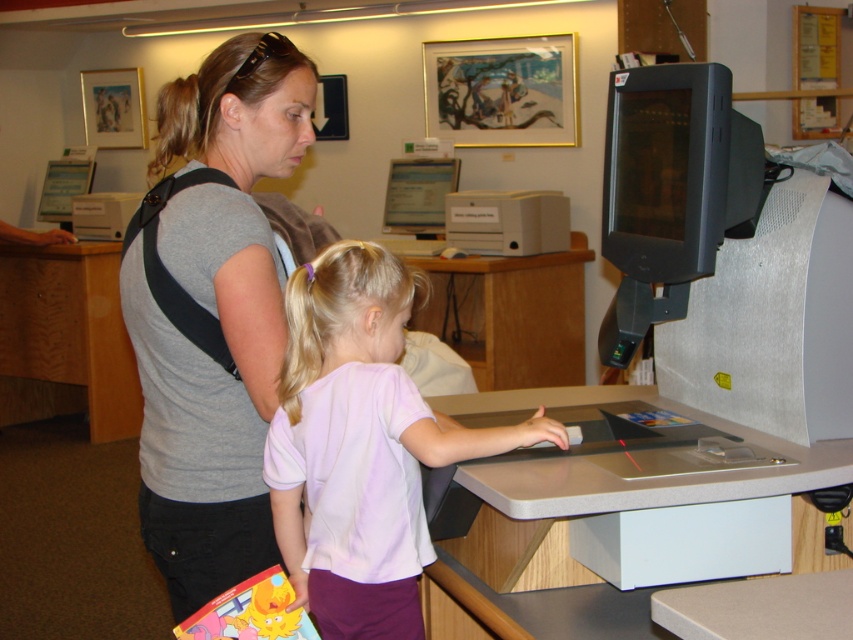
Between light purple cotton shirt at center and white plastic printer at center, which one appears on the right side from the viewer's perspective?

white plastic printer at center is more to the right.

Does point (525, 433) come farther from viewer compared to point (450, 220)?

That is False.

This screenshot has height=640, width=853. What are the coordinates of `light purple cotton shirt at center` in the screenshot? It's located at (360, 445).

Where is `light purple cotton shirt at center`? This screenshot has height=640, width=853. light purple cotton shirt at center is located at coordinates (360, 445).

Which is behind, point (225, 102) or point (402, 196)?

The point (402, 196) is more distant.

Between gray matte shirt at center and matte plastic monitor at center, which one is positioned lower?

gray matte shirt at center

Does point (229, 538) come behind point (430, 163)?

No.

Locate an element on the screen. The image size is (853, 640). gray matte shirt at center is located at coordinates (212, 310).

Does gray matte shirt at center have a lesser width compared to white plastic printer at center?

Indeed, gray matte shirt at center has a lesser width compared to white plastic printer at center.

Is gray matte shirt at center closer to the viewer compared to white plastic printer at center?

That is True.

Does point (225, 518) lie behind point (558, 198)?

No, it is not.

The width and height of the screenshot is (853, 640). Identify the location of gray matte shirt at center. (212, 310).